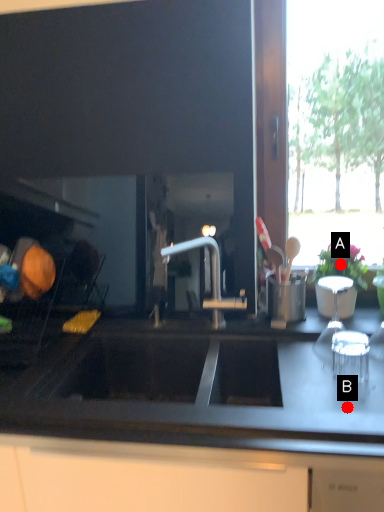
Question: Two points are circled on the image, labeled by A and B beside each circle. Which point is closer to the camera?

Choices:
 (A) A is closer
 (B) B is closer

Answer: (B)